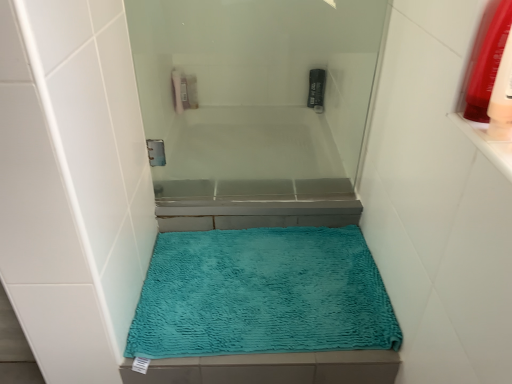
This screenshot has width=512, height=384. Find the location of `vacant space to the left of transparent glass screen door at upper center`. vacant space to the left of transparent glass screen door at upper center is located at coordinates (210, 191).